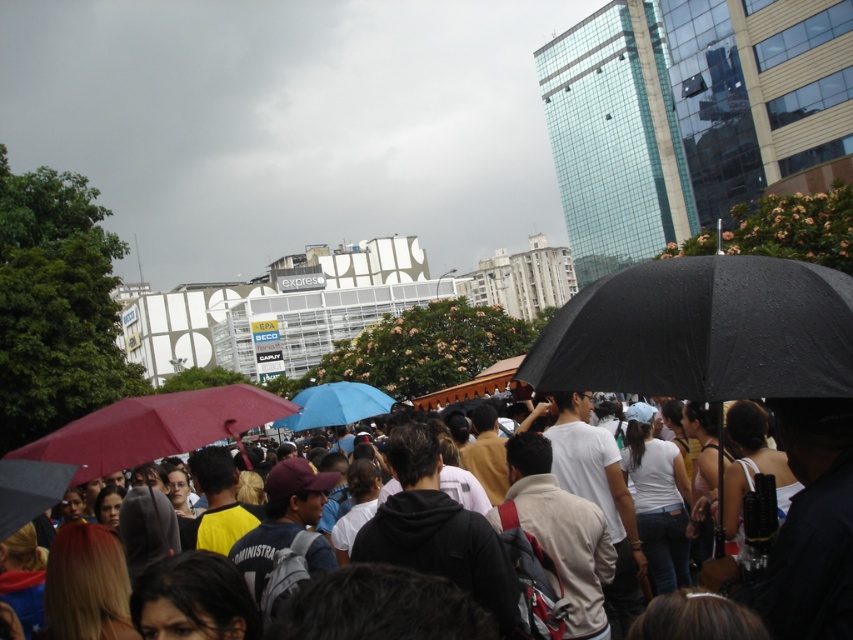
Question: Estimate the real-world distances between objects in this image. Which object is closer to the blue matte umbrella at center?

Choices:
 (A) black matte umbrella at center
 (B) matte black umbrella at center

Answer: (A)

Question: Which object appears farthest from the camera in this image?

Choices:
 (A) matte black umbrella at center
 (B) black matte umbrella at center
 (C) blue matte umbrella at center
 (D) matte red umbrella at lower left

Answer: (C)

Question: Does matte black umbrella at center appear on the left side of blue matte umbrella at center?

Choices:
 (A) no
 (B) yes

Answer: (A)

Question: Among these points, which one is farthest from the camera?

Choices:
 (A) (773, 257)
 (B) (212, 413)

Answer: (A)

Question: Does black matte umbrella at center appear over matte red umbrella at lower left?

Choices:
 (A) no
 (B) yes

Answer: (B)

Question: Does black matte umbrella at center appear on the left side of matte red umbrella at lower left?

Choices:
 (A) no
 (B) yes

Answer: (A)